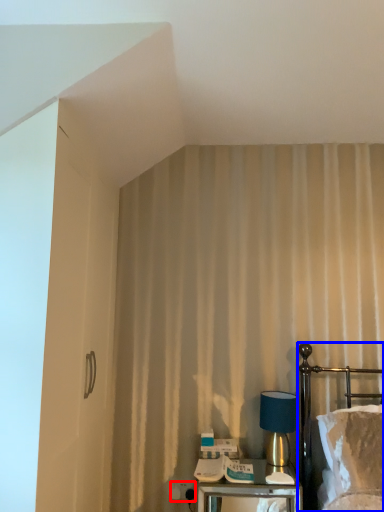
Question: Among these objects, which one is nearest to the camera, electric outlet (highlighted by a red box) or bed (highlighted by a blue box)?

Choices:
 (A) electric outlet
 (B) bed

Answer: (B)